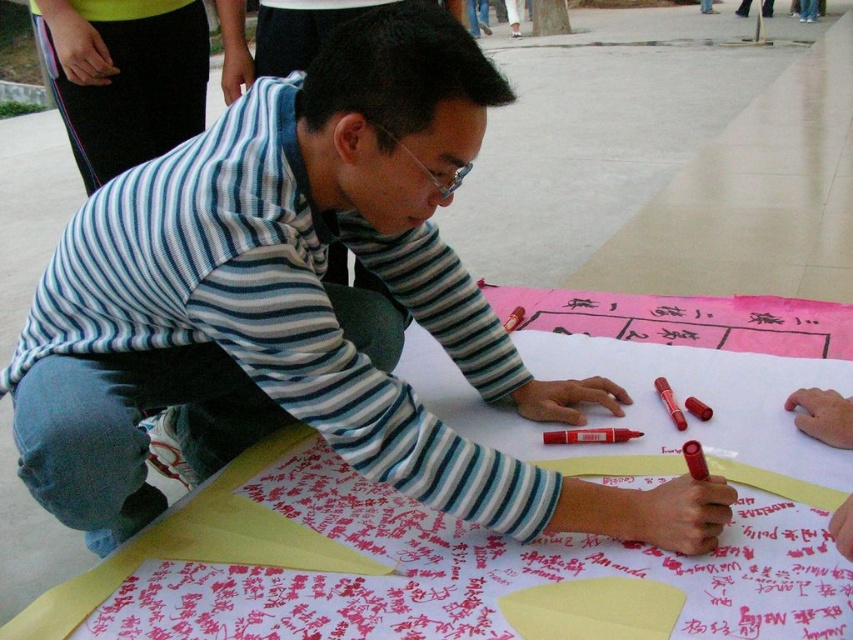
In the scene shown: Who is higher up, red matte marker at center or matte red marker at center?

matte red marker at center is higher up.

Is red matte marker at center bigger than matte red marker at center?

No, red matte marker at center is not bigger than matte red marker at center.

Where is `red matte marker at center`? red matte marker at center is located at coordinates (589, 435).

Identify the location of red matte marker at center. This screenshot has width=853, height=640. [589, 435].